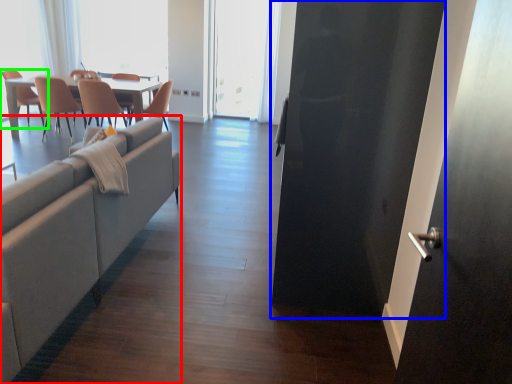
Question: Estimate the real-world distances between objects in this image. Which object is closer to studio couch (highlighted by a red box), screen door (highlighted by a blue box) or chair (highlighted by a green box)?

Choices:
 (A) screen door
 (B) chair

Answer: (A)